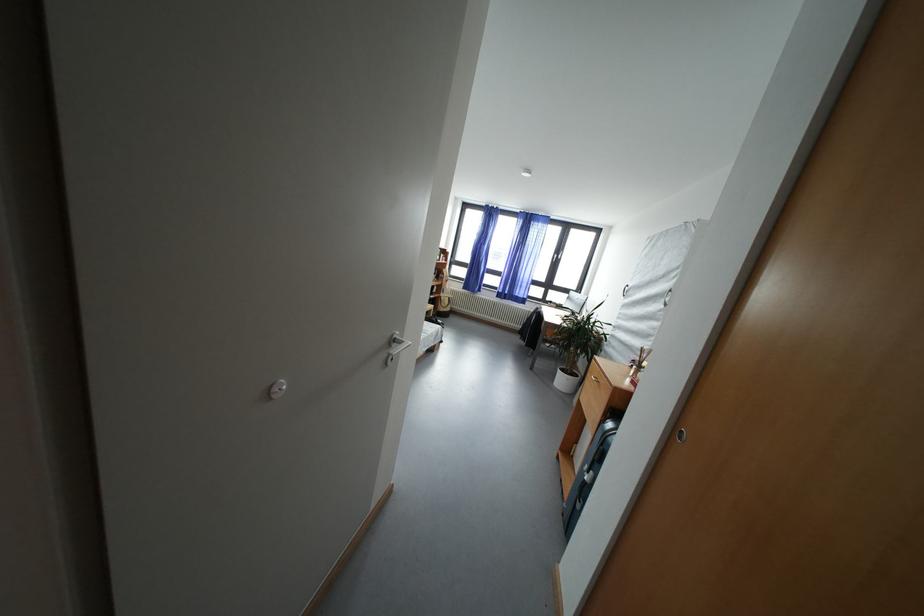
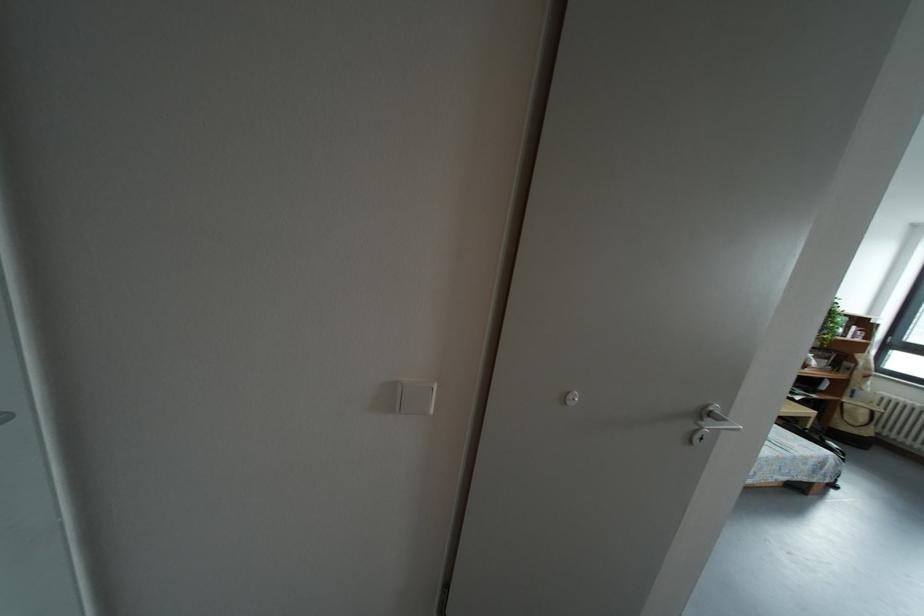
Where in the second image is the point corresponding to (x=282, y=394) from the first image?

(577, 402)